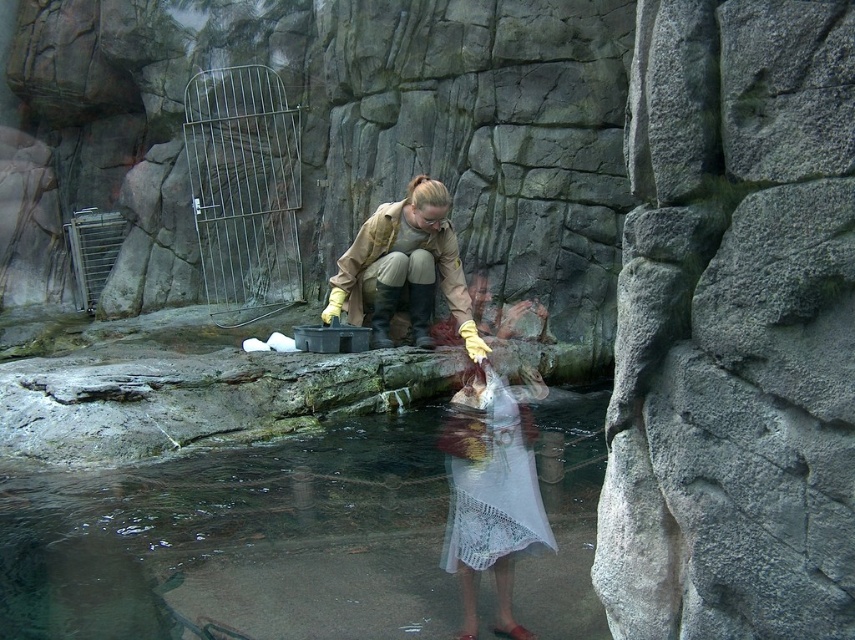
Question: Based on their relative distances, which object is farther from the white lace dress at lower center?

Choices:
 (A) tan leather jacket at center
 (B) clear water at lower center

Answer: (A)

Question: Is clear water at lower center to the right of white lace dress at lower center from the viewer's perspective?

Choices:
 (A) yes
 (B) no

Answer: (B)

Question: Is clear water at lower center wider than brushed metal gate at upper left?

Choices:
 (A) no
 (B) yes

Answer: (B)

Question: Is brushed metal gate at upper left positioned behind tan leather jacket at center?

Choices:
 (A) no
 (B) yes

Answer: (B)

Question: Which of the following is the closest to the observer?

Choices:
 (A) brushed metal gate at upper left
 (B) tan leather jacket at center

Answer: (B)

Question: Among these points, which one is farthest from the camera?

Choices:
 (A) (463, 449)
 (B) (278, 580)
 (C) (414, 198)

Answer: (C)